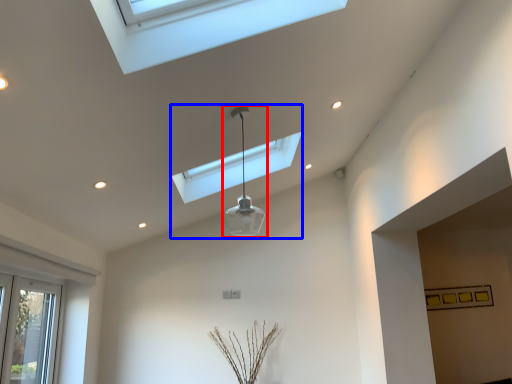
Question: Which of the following is the closest to the observer, lamp (highlighted by a red box) or lamp (highlighted by a blue box)?

Choices:
 (A) lamp
 (B) lamp

Answer: (A)